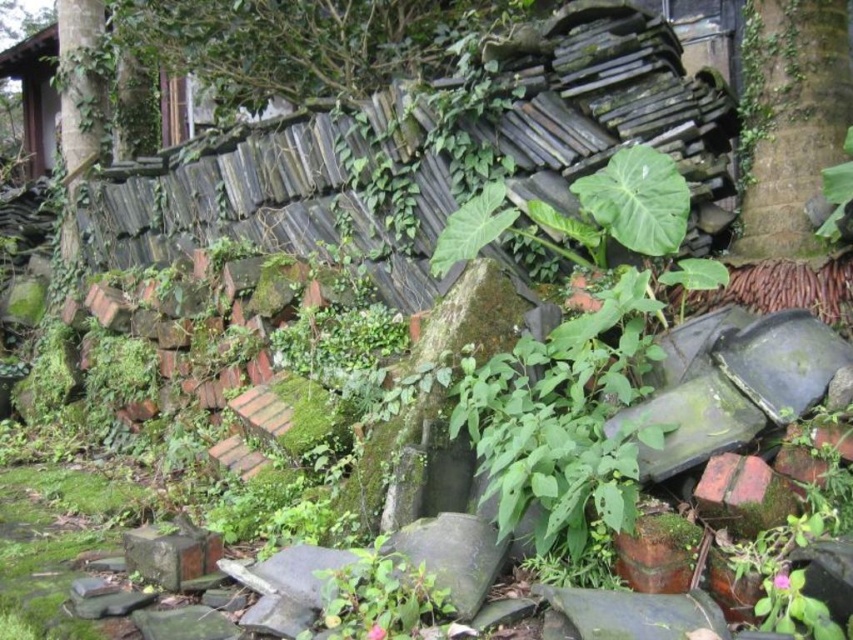
You are a botanist studying the growth patterns of plants in abandoned areas. You observe the green leafy tree at upper center and the green mossy tree trunk at upper right. Which of these two plants is positioned higher in the scene?

The green leafy tree at upper center is positioned higher than the green mossy tree trunk at upper right.

You are a botanist studying the growth patterns of trees in abandoned areas. You observe the green leafy tree at upper center and the green mossy tree trunk at upper right. Which tree has a shorter height?

The green leafy tree at upper center has a lesser height compared to the green mossy tree trunk at upper right, so the green leafy tree at upper center is shorter in height.

You are standing in front of the dilapidated wall. You notice a green leafy tree at upper center and a green mossy tree trunk at upper right. Which tree is closer to you?

The green leafy tree at upper center is closer to you because it is further to the viewer than the green mossy tree trunk at upper right.